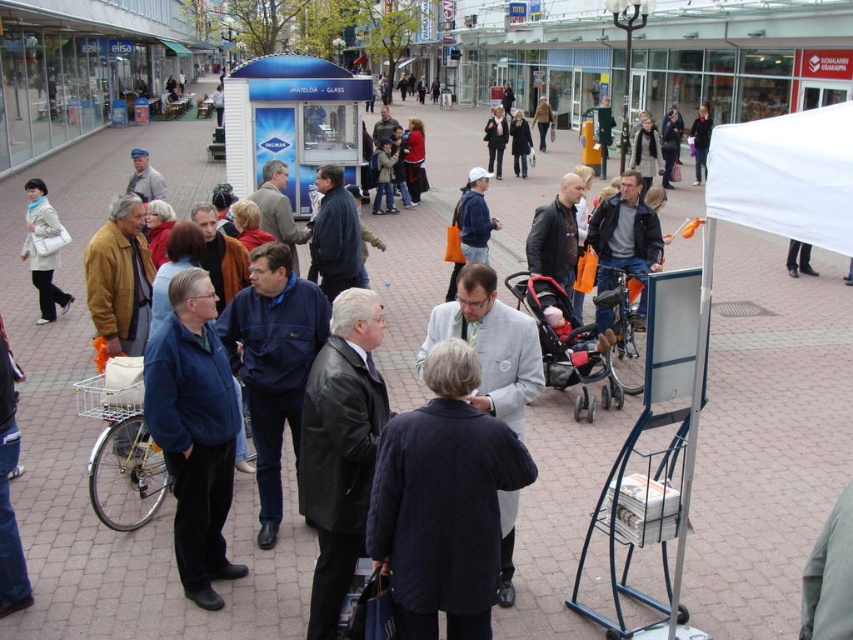
Question: Which point is closer to the camera taking this photo?

Choices:
 (A) coord(407,486)
 (B) coord(26,205)
 (C) coord(741,204)
 (D) coord(492,113)

Answer: (A)

Question: Can you confirm if navy blue jacket at center is positioned to the right of red fabric baby carriage at center?

Choices:
 (A) no
 (B) yes

Answer: (A)

Question: Which object appears farthest from the camera in this image?

Choices:
 (A) matte white bag at left
 (B) light blue fabric jacket at center
 (C) dark gray jacket at center
 (D) black leather jacket at center

Answer: (B)

Question: Can you confirm if matte white bag at left is positioned above light blue fabric jacket at center?

Choices:
 (A) yes
 (B) no

Answer: (B)

Question: Among these points, which one is nearest to the camera?

Choices:
 (A) (48, 227)
 (B) (329, 572)

Answer: (B)

Question: Is red fabric baby carriage at center below dark blue jacket at upper right?

Choices:
 (A) yes
 (B) no

Answer: (A)